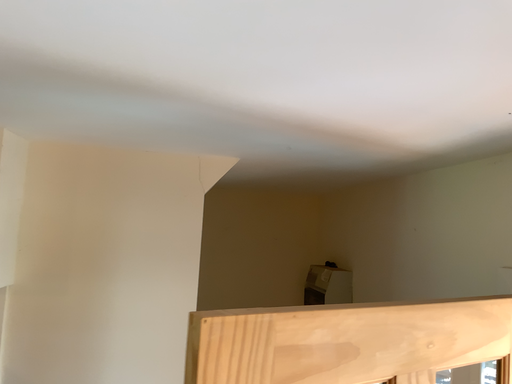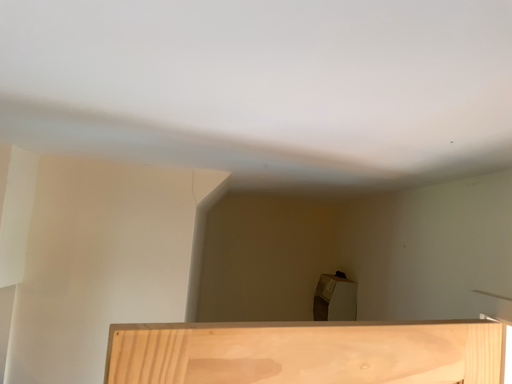
Question: How did the camera likely rotate when shooting the video?

Choices:
 (A) rotated left
 (B) rotated right

Answer: (A)